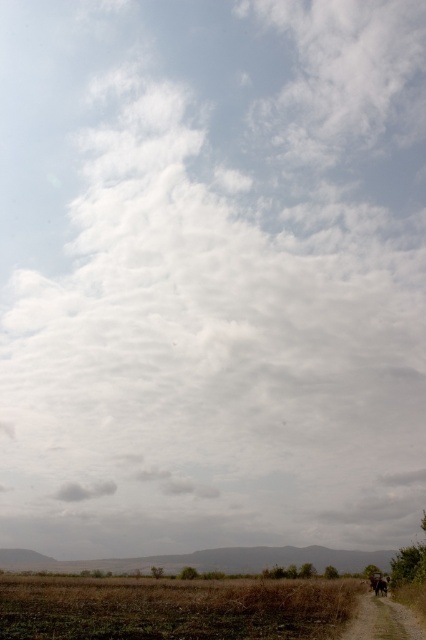
Does brown grassy field at lower center have a lesser width compared to brown dirt track at lower right?

No.

Does brown grassy field at lower center have a lesser height compared to brown dirt track at lower right?

No.

Describe the element at coordinates (172, 608) in the screenshot. I see `brown grassy field at lower center` at that location.

At what (x,y) coordinates should I click in order to perform the action: click on brown grassy field at lower center. Please return your answer as a coordinate pair (x, y). The width and height of the screenshot is (426, 640). Looking at the image, I should click on (172, 608).